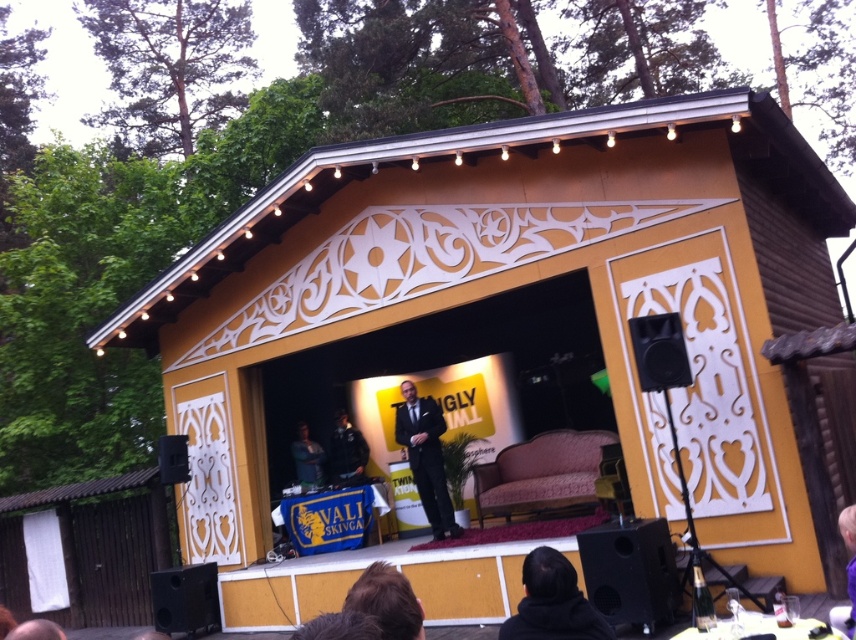
Is point (603, 637) farther from viewer compared to point (432, 436)?

No, (603, 637) is in front of (432, 436).

Is point (548, 561) in front of point (431, 465)?

Yes, it is.

Is point (539, 582) positioned in front of point (425, 481)?

Yes, point (539, 582) is closer to viewer.

Identify the location of black fabric at lower right. This screenshot has width=856, height=640. (551, 602).

Who is higher up, black fabric at lower right or dark blue shirt at center?

black fabric at lower right is above.

Between black fabric at lower right and dark blue shirt at center, which one appears on the left side from the viewer's perspective?

From the viewer's perspective, dark blue shirt at center appears more on the left side.

The width and height of the screenshot is (856, 640). What are the coordinates of `black fabric at lower right` in the screenshot? It's located at (551, 602).

The width and height of the screenshot is (856, 640). What are the coordinates of `black fabric at lower right` in the screenshot? It's located at (551, 602).

Does matte black suit at center have a greater width compared to dark blue shirt at center?

Indeed, matte black suit at center has a greater width compared to dark blue shirt at center.

Looking at this image, is matte black suit at center further to camera compared to dark blue shirt at center?

That is False.

Which is behind, point (414, 458) or point (299, 458)?

The point (299, 458) is more distant.

The width and height of the screenshot is (856, 640). I want to click on matte black suit at center, so click(x=425, y=458).